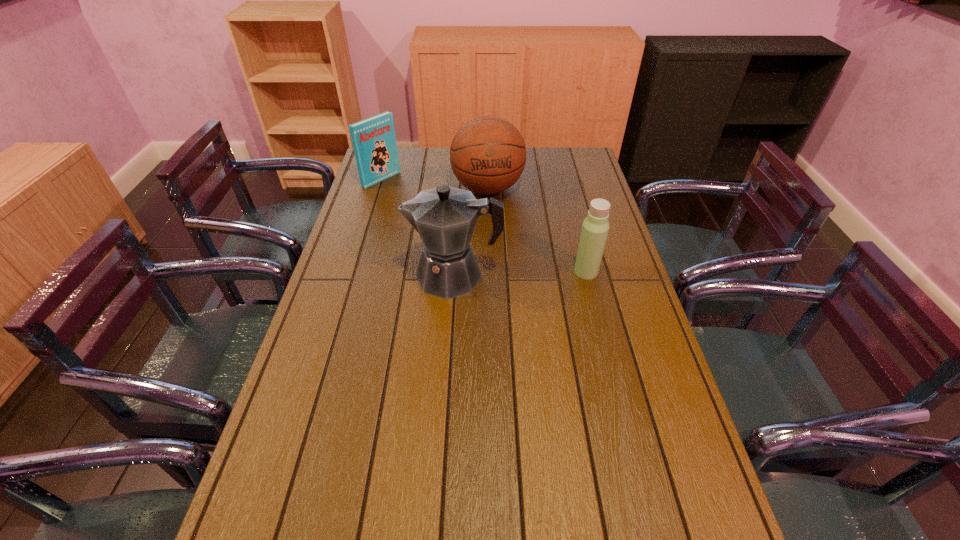
Identify the location of free point that satisfies the following two spatial constraints: 1. on the front side of the basketball; 2. on the right side of the book. This screenshot has width=960, height=540. (379, 188).